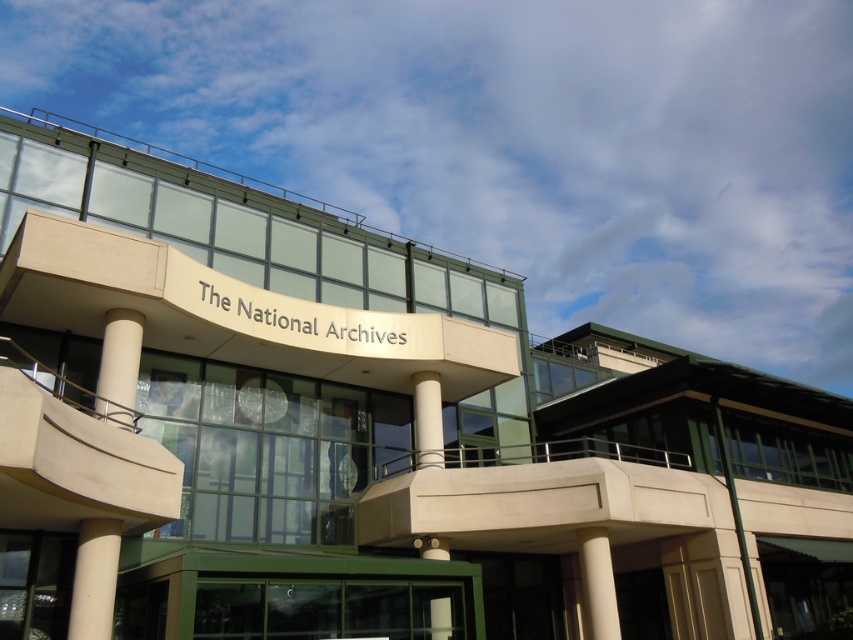
You are an architect evaluating the structural integrity of the building. You notice the white glossy pillar at center and the white smooth column at lower right. Which one might be more capable of supporting heavy loads based on their sizes?

The white glossy pillar at center has a larger size compared to the white smooth column at lower right, so it is more capable of supporting heavy loads due to its greater structural capacity.

Consider the image. You are standing at the entrance of The National Archives and want to find the white smooth pillar at lower left. According to the coordinates provided, where should you look relative to the building?

The white smooth pillar at lower left is located at coordinates point (94,579), which means it is positioned at the lower left area of the building.